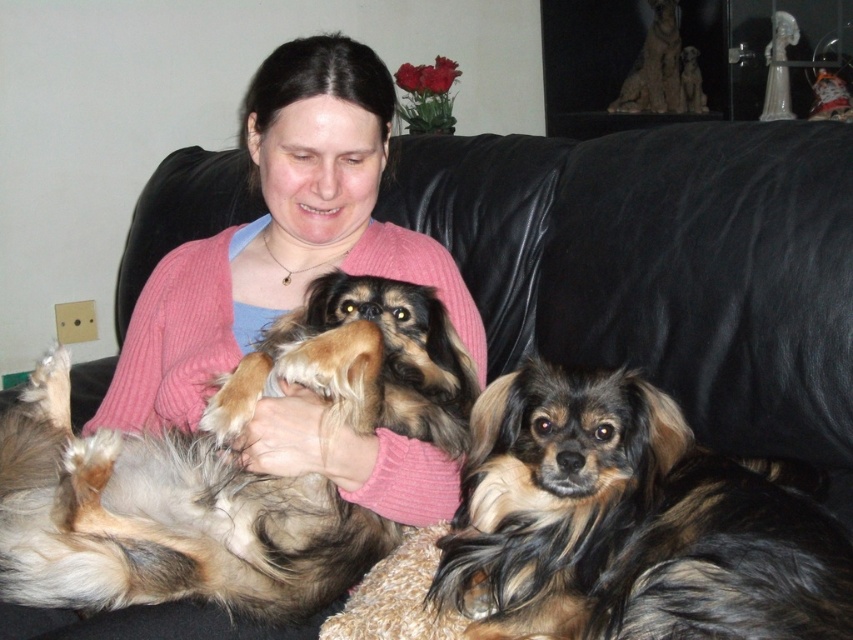
Question: Which object is closer to the camera taking this photo?

Choices:
 (A) pink knitted sweater at upper center
 (B) shaggy brown dog at center
 (C) shaggy brown fur at right

Answer: (C)

Question: Does shaggy brown dog at center have a larger size compared to pink knitted sweater at upper center?

Choices:
 (A) no
 (B) yes

Answer: (A)

Question: Which point is closer to the camera?

Choices:
 (A) pink knitted sweater at upper center
 (B) shaggy brown fur at right

Answer: (B)

Question: Does shaggy brown dog at center appear over shaggy brown fur at right?

Choices:
 (A) no
 (B) yes

Answer: (B)

Question: Which point is farther to the camera?

Choices:
 (A) pink knitted sweater at upper center
 (B) shaggy brown dog at center
 (C) shaggy brown fur at right

Answer: (A)

Question: Can you confirm if shaggy brown dog at center is positioned to the left of shaggy brown fur at right?

Choices:
 (A) no
 (B) yes

Answer: (B)